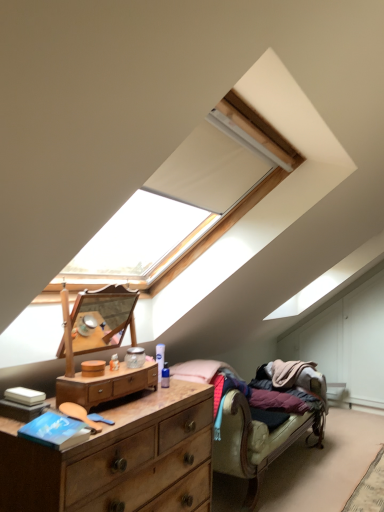
Question: From a real-world perspective, is wooden dresser at lower left, which is counted as the second chest of drawers, starting from the top, located higher than wooden dresser at center, acting as the 1th chest of drawers starting from the top?

Choices:
 (A) no
 (B) yes

Answer: (A)

Question: Considering the relative positions of wooden dresser at lower left, acting as the first chest of drawers starting from the bottom, and wooden dresser at center, acting as the 1th chest of drawers starting from the top, in the image provided, is wooden dresser at lower left, acting as the first chest of drawers starting from the bottom, in front of wooden dresser at center, acting as the 1th chest of drawers starting from the top,?

Choices:
 (A) yes
 (B) no

Answer: (A)

Question: Is wooden dresser at lower left, acting as the first chest of drawers starting from the bottom, touching wooden dresser at center, acting as the 1th chest of drawers starting from the top?

Choices:
 (A) yes
 (B) no

Answer: (B)

Question: Are wooden dresser at lower left, which is counted as the second chest of drawers, starting from the top, and wooden dresser at center, which is the second chest of drawers in bottom-to-top order, located far from each other?

Choices:
 (A) yes
 (B) no

Answer: (B)

Question: Can you confirm if wooden dresser at lower left, acting as the first chest of drawers starting from the bottom, is wider than wooden dresser at center, which is the second chest of drawers in bottom-to-top order?

Choices:
 (A) no
 (B) yes

Answer: (B)

Question: Is wooden dresser at lower left, acting as the first chest of drawers starting from the bottom, outside of wooden dresser at center, acting as the 1th chest of drawers starting from the top?

Choices:
 (A) yes
 (B) no

Answer: (A)

Question: Is wooden dresser at center, which is the second chest of drawers in bottom-to-top order, thinner than wooden dresser at lower left, acting as the first chest of drawers starting from the bottom?

Choices:
 (A) yes
 (B) no

Answer: (A)

Question: Is the position of wooden dresser at center, which is the second chest of drawers in bottom-to-top order, less distant than that of wooden dresser at lower left, which is counted as the second chest of drawers, starting from the top?

Choices:
 (A) yes
 (B) no

Answer: (B)

Question: Does wooden dresser at center, which is the second chest of drawers in bottom-to-top order, have a greater height compared to wooden dresser at lower left, which is counted as the second chest of drawers, starting from the top?

Choices:
 (A) no
 (B) yes

Answer: (A)

Question: From a real-world perspective, is wooden dresser at center, which is the second chest of drawers in bottom-to-top order, positioned over wooden dresser at lower left, which is counted as the second chest of drawers, starting from the top, based on gravity?

Choices:
 (A) no
 (B) yes

Answer: (B)

Question: Would you say wooden dresser at center, acting as the 1th chest of drawers starting from the top, is a long distance from wooden dresser at lower left, acting as the first chest of drawers starting from the bottom?

Choices:
 (A) yes
 (B) no

Answer: (B)

Question: Are wooden dresser at center, acting as the 1th chest of drawers starting from the top, and wooden dresser at lower left, which is counted as the second chest of drawers, starting from the top, beside each other?

Choices:
 (A) yes
 (B) no

Answer: (B)

Question: Is wooden dresser at center, which is the second chest of drawers in bottom-to-top order, turned away from wooden studio couch at lower right?

Choices:
 (A) yes
 (B) no

Answer: (B)